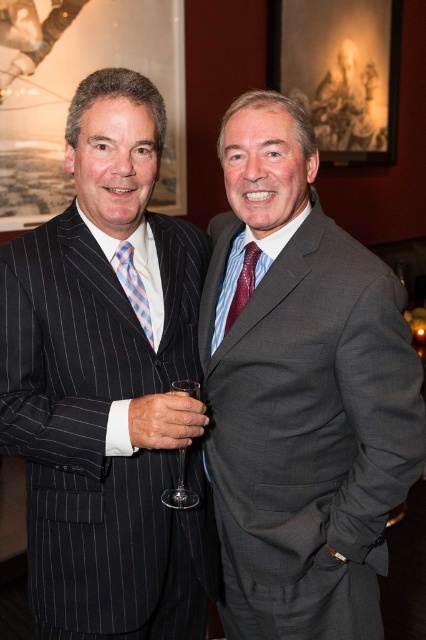
Based on the photo, which of these two, pinstriped wool suit at left or clear glass wine glass at center, stands taller?

With more height is pinstriped wool suit at left.

Identify the location of pinstriped wool suit at left. (98, 422).

Locate an element on the screen. Image resolution: width=426 pixels, height=640 pixels. pinstriped wool suit at left is located at coordinates (98, 422).

Between light blue striped tie at center and clear glass wine glass at center, which one has more height?

Standing taller between the two is clear glass wine glass at center.

Looking at this image, is light blue striped tie at center shorter than clear glass wine glass at center?

Correct, light blue striped tie at center is not as tall as clear glass wine glass at center.

Describe the element at coordinates (132, 285) in the screenshot. I see `light blue striped tie at center` at that location.

The height and width of the screenshot is (640, 426). Identify the location of light blue striped tie at center. pos(132,285).

Who is positioned more to the left, gray wool suit at right or clear glass wine glass at center?

clear glass wine glass at center

Image resolution: width=426 pixels, height=640 pixels. What do you see at coordinates (308, 433) in the screenshot?
I see `gray wool suit at right` at bounding box center [308, 433].

Locate an element on the screen. gray wool suit at right is located at coordinates (308, 433).